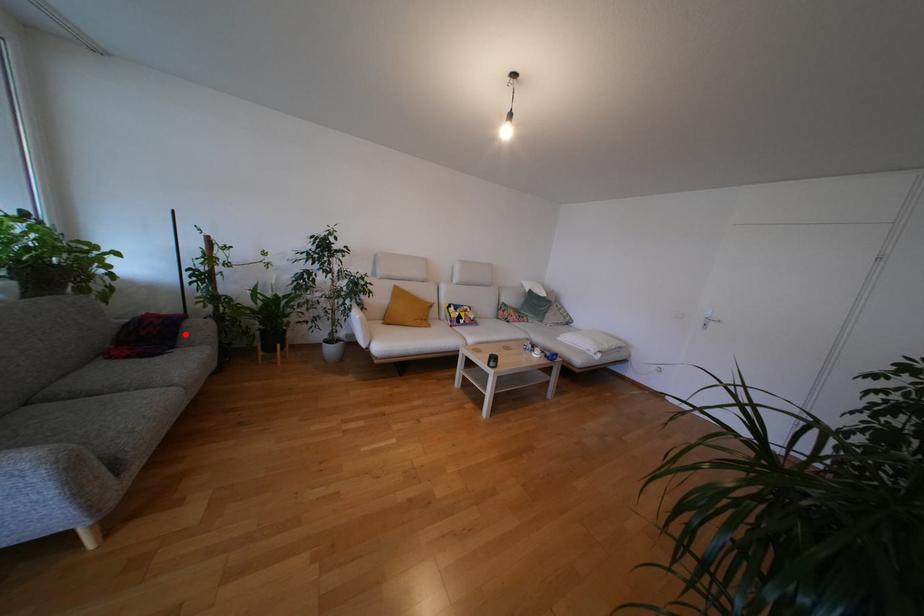
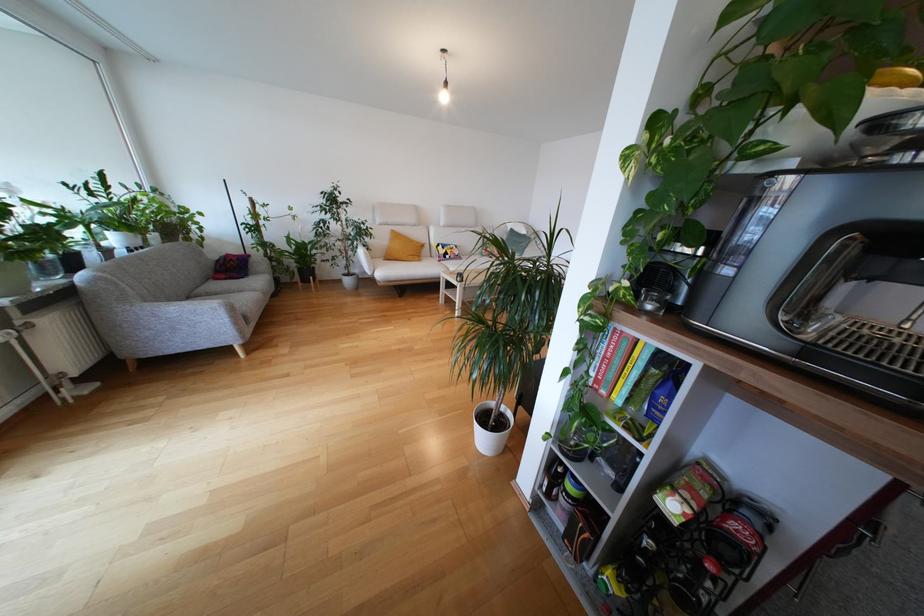
Where in the second image is the point corresponding to the highlighted location from the first image?

(253, 268)